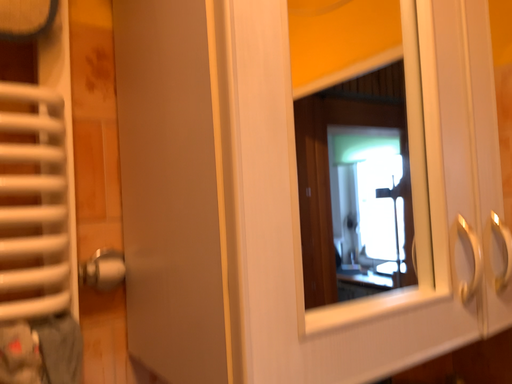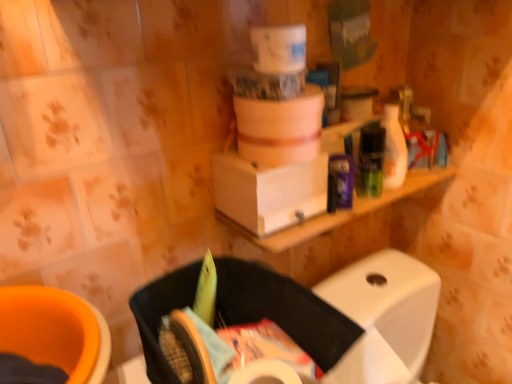
Question: Which way did the camera rotate in the video?

Choices:
 (A) rotated upward
 (B) rotated downward

Answer: (B)